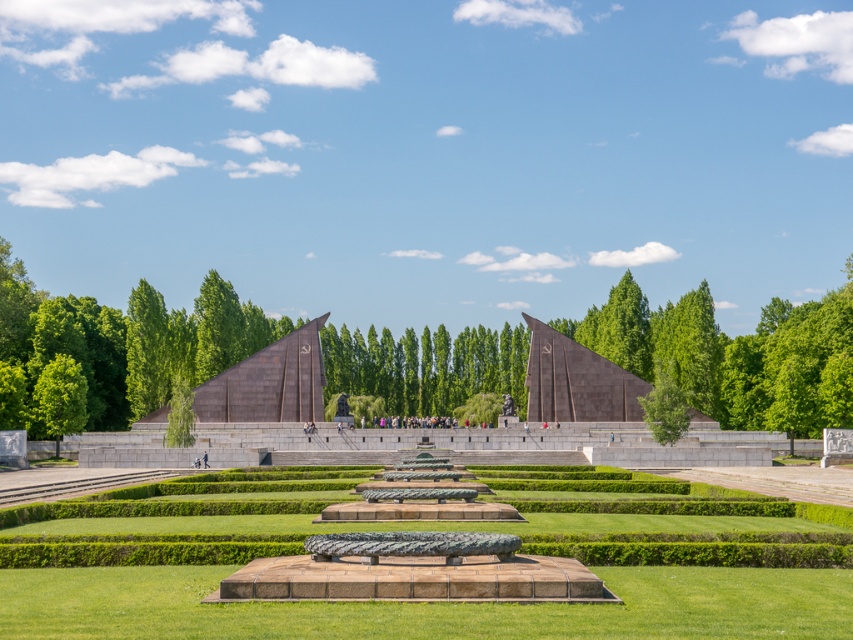
Question: Which point is farther to the camera?

Choices:
 (A) green leafy trees at center
 (B) green grass at center
 (C) green leafy tree at lower left
 (D) green leafy tree at center

Answer: (A)

Question: Can you confirm if green grass at center is bigger than green leafy tree at lower left?

Choices:
 (A) yes
 (B) no

Answer: (A)

Question: Which point is closer to the camera?

Choices:
 (A) green leafy tree at lower left
 (B) green leafy tree at center
 (C) green leafy trees at center

Answer: (A)

Question: Can you confirm if green grass at center is positioned above green leafy tree at lower left?

Choices:
 (A) no
 (B) yes

Answer: (A)

Question: Does green leafy trees at center have a greater width compared to green leafy tree at lower left?

Choices:
 (A) no
 (B) yes

Answer: (B)

Question: Estimate the real-world distances between objects in this image. Which object is closer to the green leafy trees at center?

Choices:
 (A) green leafy tree at lower left
 (B) green grass at center
 (C) green leafy tree at center

Answer: (C)